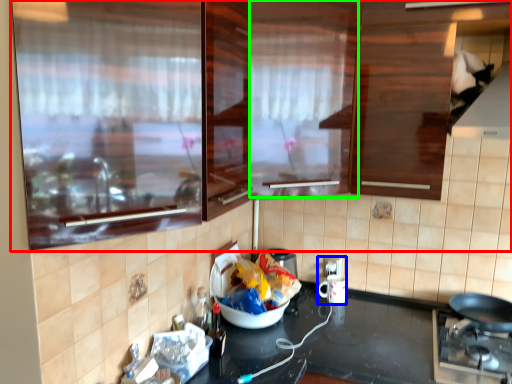
Question: Which is nearer to the cabinetry (highlighted by a red box)? appliance (highlighted by a blue box) or glass door (highlighted by a green box).

Choices:
 (A) appliance
 (B) glass door

Answer: (B)